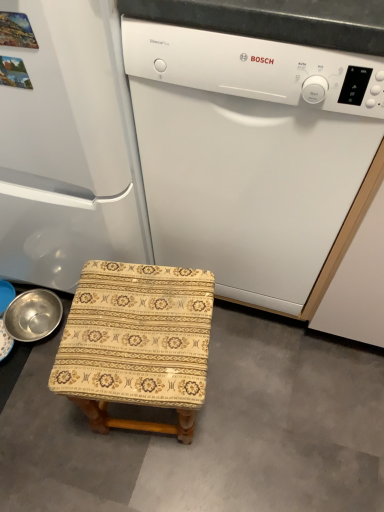
The image size is (384, 512). What are the coordinates of `blank space above beige fabric stool at lower left (from a real-world perspective)` in the screenshot? It's located at (194, 426).